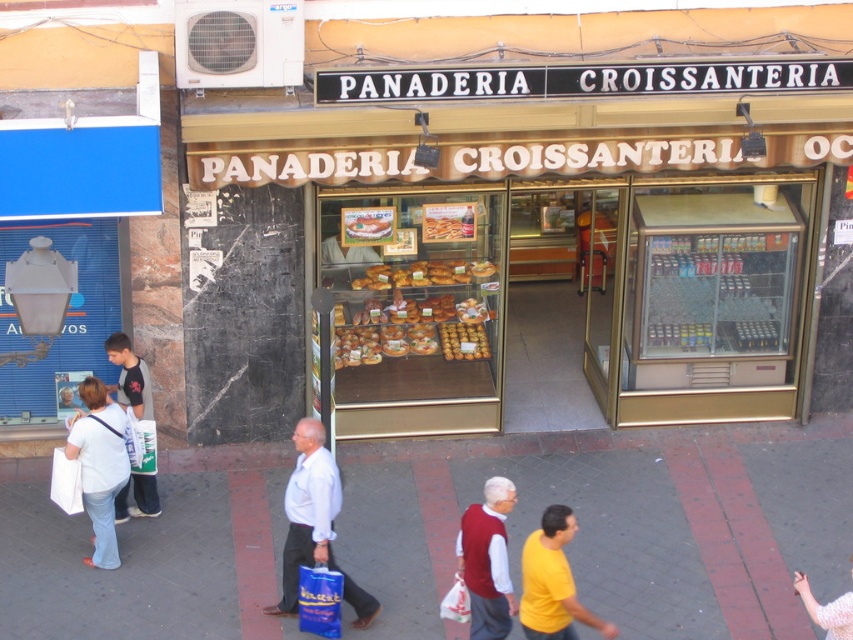
You are standing in front of the bakery and notice two points on the facade. The first point is at coordinate point [128,394] and the second is at point [465,220]. Which point is closer to you?

Point [128,394] is closer to the viewer than point [465,220].

You are a customer entering the bakery and see the white cotton shirt at center and the blue plastic bag at lower center. Which item is higher up from the ground?

The white cotton shirt at center is taller than the blue plastic bag at lower center, so the white cotton shirt at center is higher up from the ground.